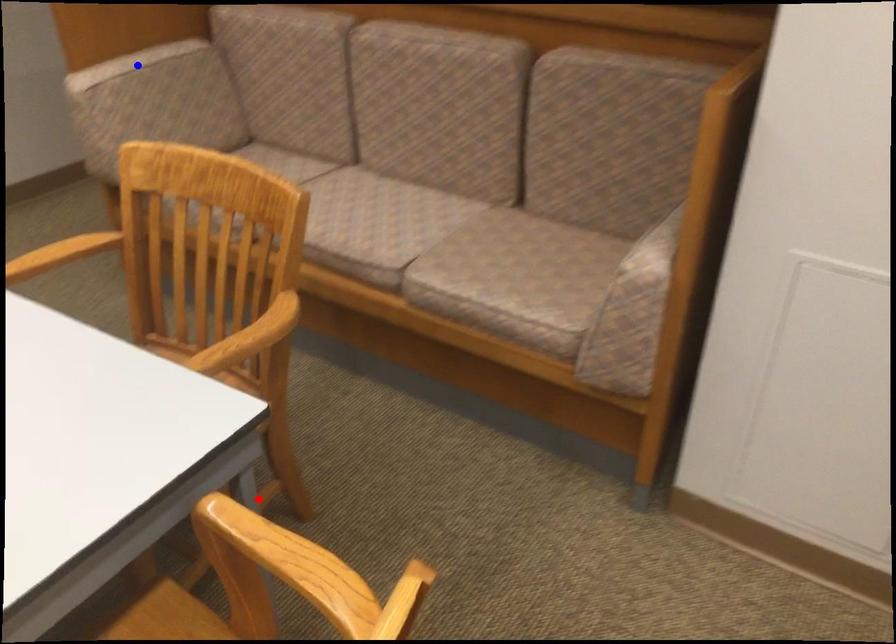
Question: In the image, two points are highlighted. Which point is nearer to the camera? Reply with the corresponding letter.

Choices:
 (A) blue point
 (B) red point

Answer: (B)